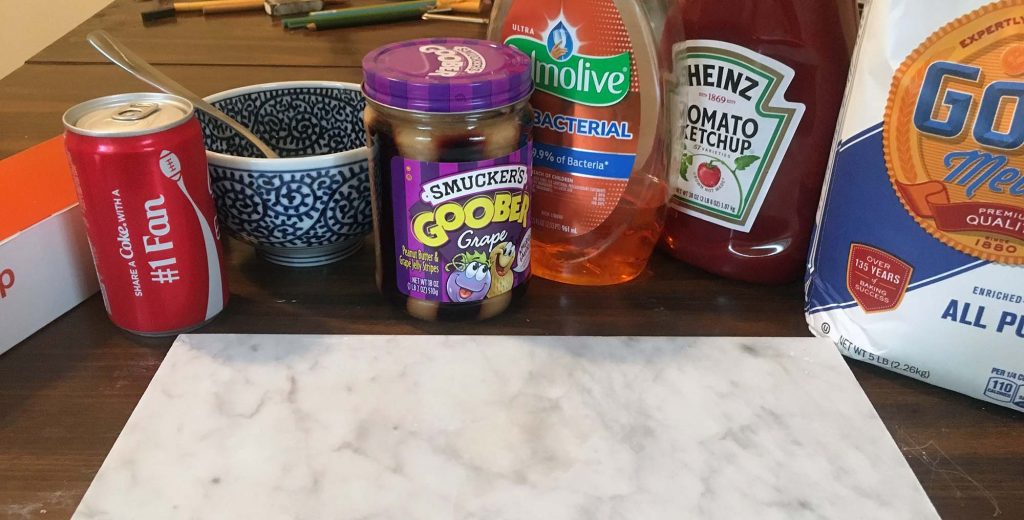
I want to click on marble, so click(504, 423).